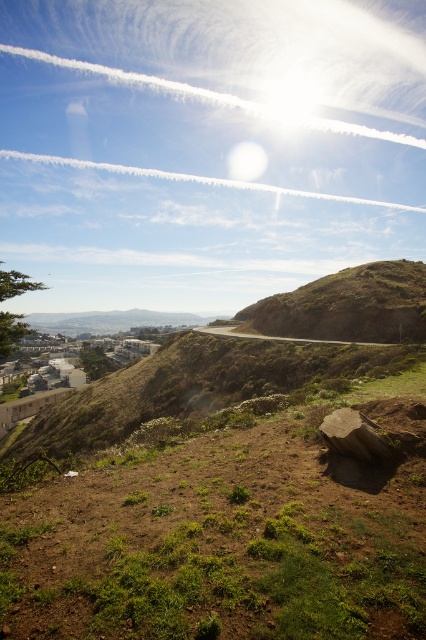
Question: Does green grassy hillside at upper right appear under brown rough rock at lower right?

Choices:
 (A) no
 (B) yes

Answer: (A)

Question: Can you confirm if green grassy at center is positioned to the right of green grassy hillside at upper right?

Choices:
 (A) yes
 (B) no

Answer: (B)

Question: Among these objects, which one is farthest from the camera?

Choices:
 (A) brown rough rock at lower right
 (B) green grassy hillside at upper right
 (C) green grassy at center

Answer: (B)

Question: Which object is farther from the camera taking this photo?

Choices:
 (A) green grassy hillside at upper right
 (B) green grassy at center

Answer: (A)

Question: Is green grassy at center to the left of brown rough rock at lower right from the viewer's perspective?

Choices:
 (A) yes
 (B) no

Answer: (A)

Question: Among these points, which one is nearest to the camera?

Choices:
 (A) (244, 454)
 (B) (354, 440)
 (C) (385, 333)

Answer: (B)